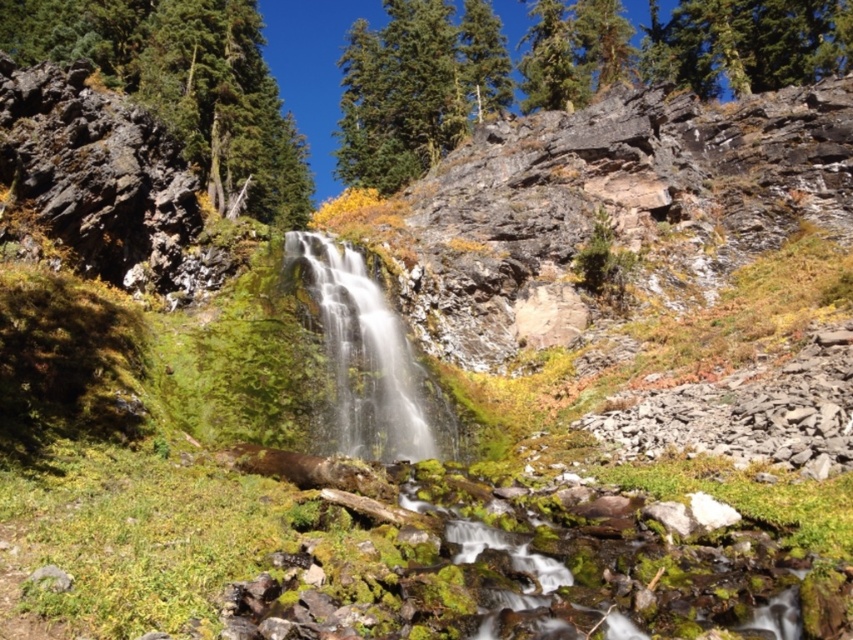
Question: Which point is farther to the camera?

Choices:
 (A) (206, 81)
 (B) (352, 378)
 (C) (387, 106)

Answer: (C)

Question: Is green rough bark tree at upper center positioned at the back of white frothy water at center?

Choices:
 (A) no
 (B) yes

Answer: (B)

Question: Which of the following is the closest to the observer?

Choices:
 (A) green rough bark tree at upper center
 (B) green rough bark tree at upper left
 (C) white frothy water at center

Answer: (C)

Question: Which object is closer to the camera taking this photo?

Choices:
 (A) green rough bark tree at upper center
 (B) green rough bark tree at upper left
 (C) white frothy water at center

Answer: (C)

Question: Observing the image, what is the correct spatial positioning of green rough bark tree at upper center in reference to white frothy water at center?

Choices:
 (A) right
 (B) left

Answer: (A)

Question: Does green rough bark tree at upper center have a larger size compared to white frothy water at center?

Choices:
 (A) yes
 (B) no

Answer: (A)